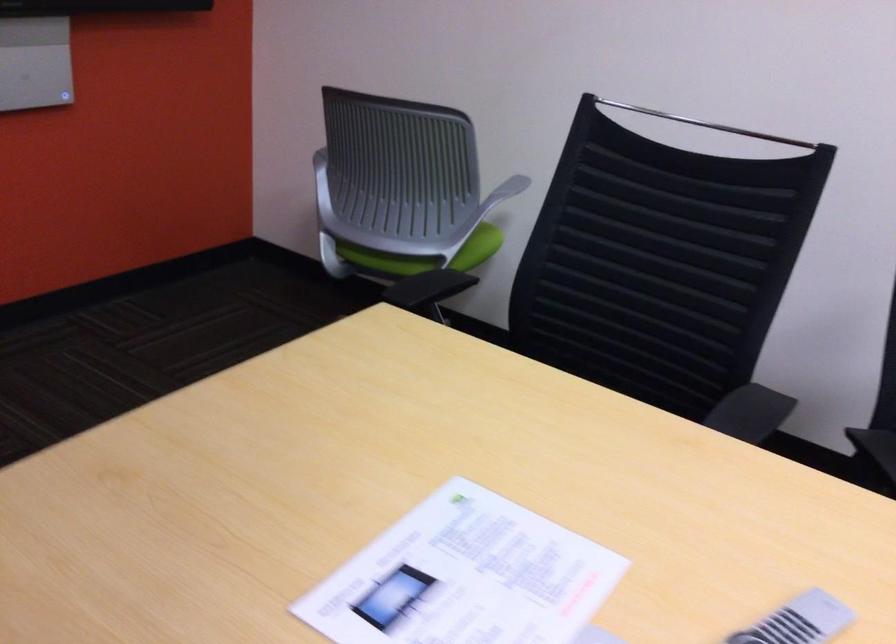
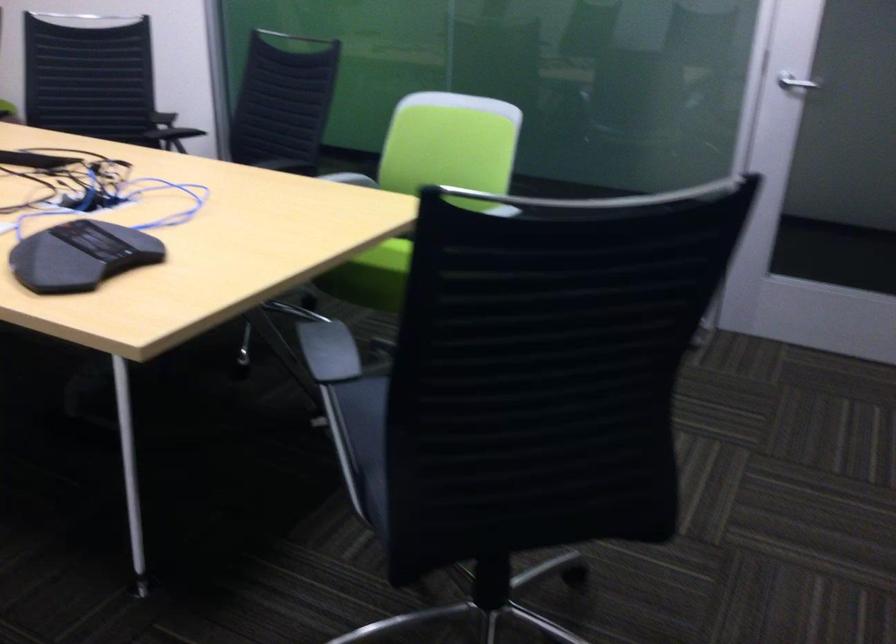
The images are taken continuously from a first-person perspective. In which direction are you moving?

The cameraman moved toward right, backward.